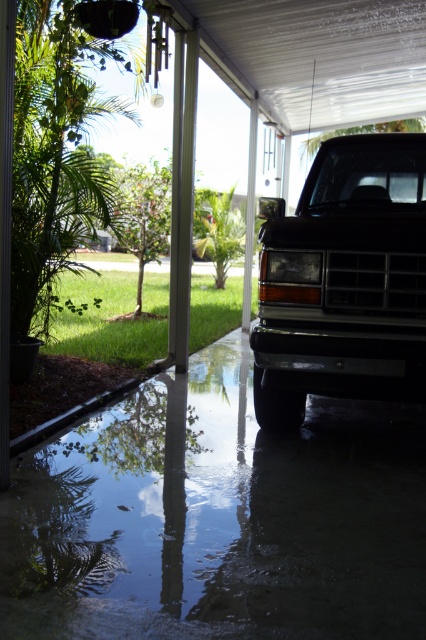
Based on the photo, how distant is glossy concrete flood at lower center from black matte truck at center?

glossy concrete flood at lower center and black matte truck at center are 1.37 meters apart from each other.

Consider the image. Which of these two, glossy concrete flood at lower center or black matte truck at center, stands taller?

black matte truck at center is taller.

Is point (374, 436) positioned behind point (423, 154)?

No, (374, 436) is closer to viewer.

At what (x,y) coordinates should I click in order to perform the action: click on glossy concrete flood at lower center. Please return your answer as a coordinate pair (x, y). Image resolution: width=426 pixels, height=640 pixels. Looking at the image, I should click on (218, 516).